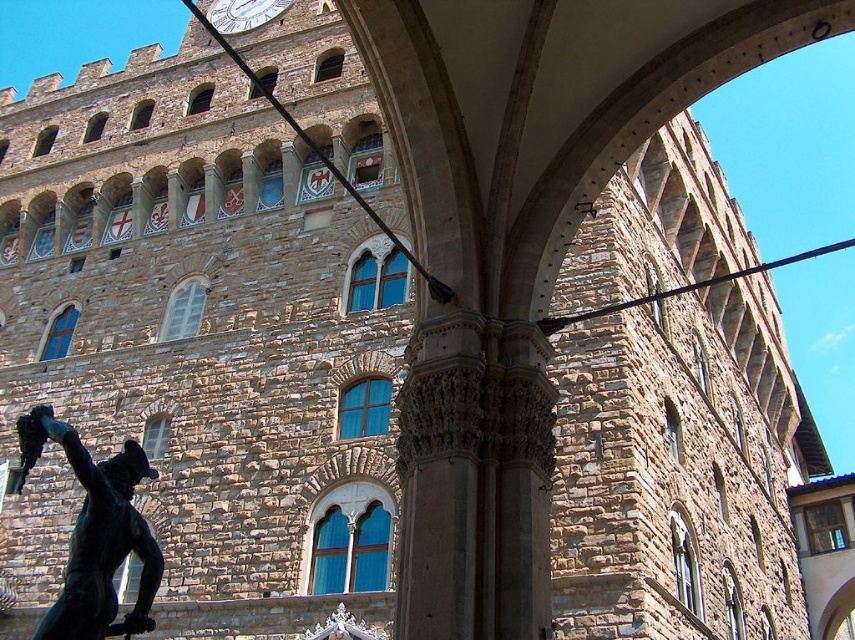
You are standing at the entrance of the historic stone building and see two points marked on the facade. The first point is at coordinate point (84, 477) and the second is at point (258, 20). Which point is closer to you?

Point (84, 477) is in front of point (258, 20), so it is closer to you.

Based on the photo, you are standing at the center of the image. Which direction should you walk to reach the green patina bronze statue at lower left?

You should walk towards the lower left direction to reach the green patina bronze statue at lower left.

You are standing in front of the historic stone building and want to take a photo of the green patina bronze statue at lower left without the white glossy clock at upper center appearing in the frame. Is this possible given their positions?

The green patina bronze statue at lower left is positioned under the white glossy clock at upper center. Since the statue is directly below the clock, it would be challenging to frame the statue without including the clock in the photo unless you angle the camera downward significantly or move to a position where the clock is obscured by another object.